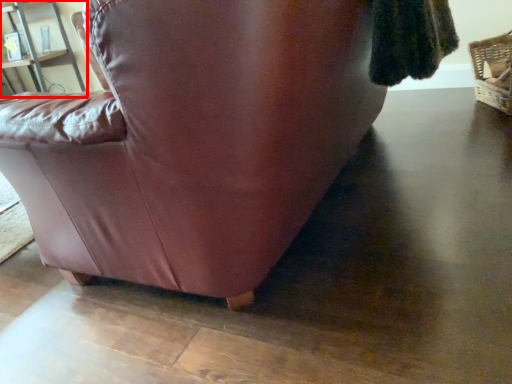
Question: From the image's perspective, considering the relative positions of shelf (annotated by the red box) and basket in the image provided, where is shelf (annotated by the red box) located with respect to the staircase?

Choices:
 (A) above
 (B) below

Answer: (A)